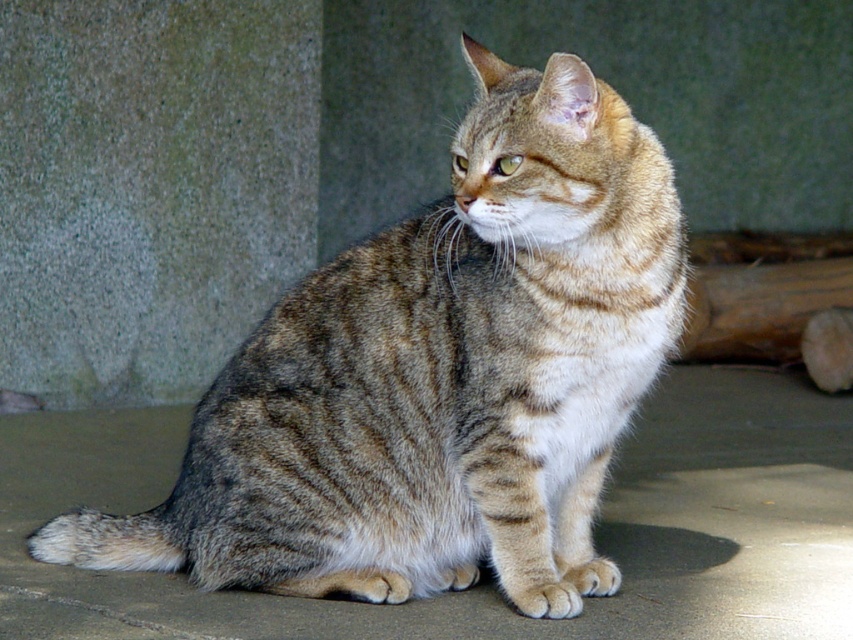
Question: Can you confirm if gray textured wall at left is thinner than gray concrete at center?

Choices:
 (A) yes
 (B) no

Answer: (A)

Question: Which object is the farthest from the tabby fur cat at center?

Choices:
 (A) gray concrete at center
 (B) gray textured wall at left

Answer: (B)

Question: Does tabby fur cat at center have a larger size compared to gray concrete at center?

Choices:
 (A) no
 (B) yes

Answer: (A)

Question: Which object is positioned closest to the gray textured wall at left?

Choices:
 (A) gray concrete at center
 (B) tabby fur cat at center

Answer: (A)

Question: Considering the real-world distances, which object is farthest from the gray textured wall at left?

Choices:
 (A) tabby fur cat at center
 (B) gray concrete at center

Answer: (A)

Question: Observing the image, what is the correct spatial positioning of tabby fur cat at center in reference to gray textured wall at left?

Choices:
 (A) left
 (B) right

Answer: (B)